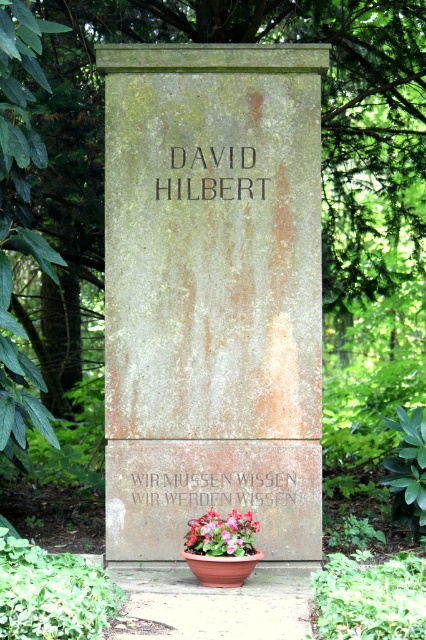
Does green leafy tree at upper center appear over black stone writing at center?

Yes, green leafy tree at upper center is above black stone writing at center.

Can you confirm if green leafy tree at upper center is positioned to the left of black stone writing at center?

No, green leafy tree at upper center is not to the left of black stone writing at center.

Describe the element at coordinates (322, 145) in the screenshot. I see `green leafy tree at upper center` at that location.

This screenshot has height=640, width=426. I want to click on green leafy tree at upper center, so click(322, 145).

Which is more to the right, green leafy tree at upper center or dark brown stone engraving at center?

Positioned to the right is green leafy tree at upper center.

Describe the element at coordinates (322, 145) in the screenshot. The height and width of the screenshot is (640, 426). I see `green leafy tree at upper center` at that location.

Is point (391, 26) behind point (178, 188)?

That is True.

The image size is (426, 640). Find the location of `green leafy tree at upper center`. green leafy tree at upper center is located at coordinates (322, 145).

Does black stone writing at center appear over floral arrangement at center?

Correct, black stone writing at center is located above floral arrangement at center.

Does black stone writing at center have a greater height compared to floral arrangement at center?

No.

Who is more distant from viewer, (192, 477) or (241, 545)?

The point (192, 477) is more distant.

The height and width of the screenshot is (640, 426). I want to click on black stone writing at center, so click(213, 488).